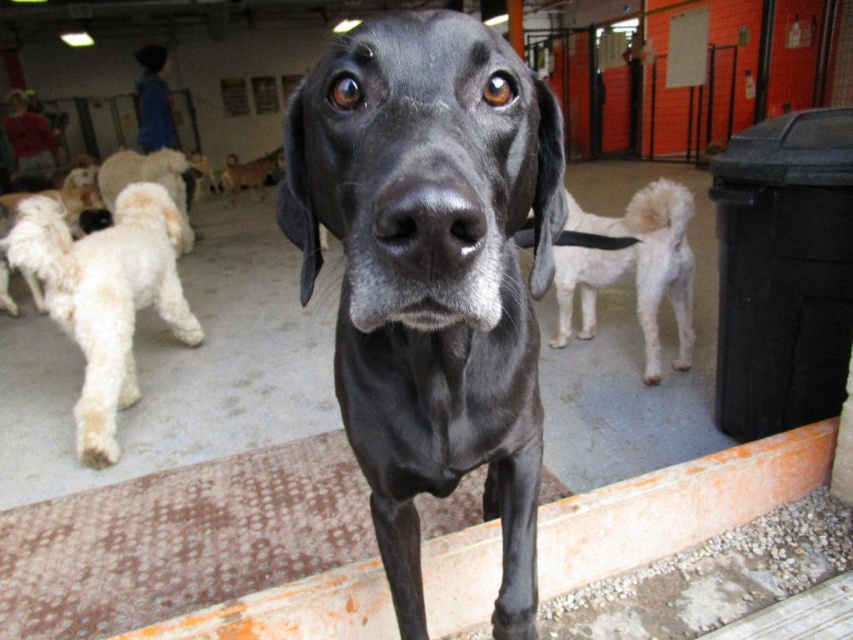
You are a visitor at the dog kennel and want to pet the white fluffy dog at left and the white fluffy dog at center. Which one is nearer to you?

The white fluffy dog at left is closer to the viewer than the white fluffy dog at center, so you can pet the white fluffy dog at left first since it is nearer.

You are a dog trainer who needs to separate two dogs for safety. The black glossy dog at center and the white fluffy dog at center are currently 1.74 meters apart. Can you safely walk between them without any risk of them reaching each other?

The distance between the black glossy dog at center and the white fluffy dog at center is 1.74 meters. Since most dogs have a reach of about 1 meter when on a leash, this distance should be safe for you to walk between them without them reaching each other.

You are standing at the point marked as point (62, 241) in the kennel. You want to toss a treat to the large black dog in the foreground. Can you reach the dog from your current position without moving closer?

The distance between you and the large black dog in the foreground is 2.68 meters. Since you are at point (62, 241), which is 2.68 meters away from the viewer, you can toss the treat to the dog as the distance is manageable for a toss.